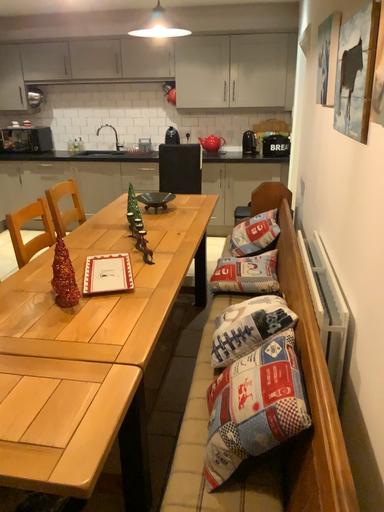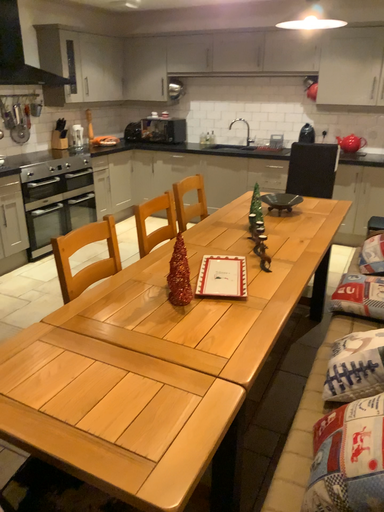
Question: Which way did the camera rotate in the video?

Choices:
 (A) rotated right
 (B) rotated left

Answer: (B)